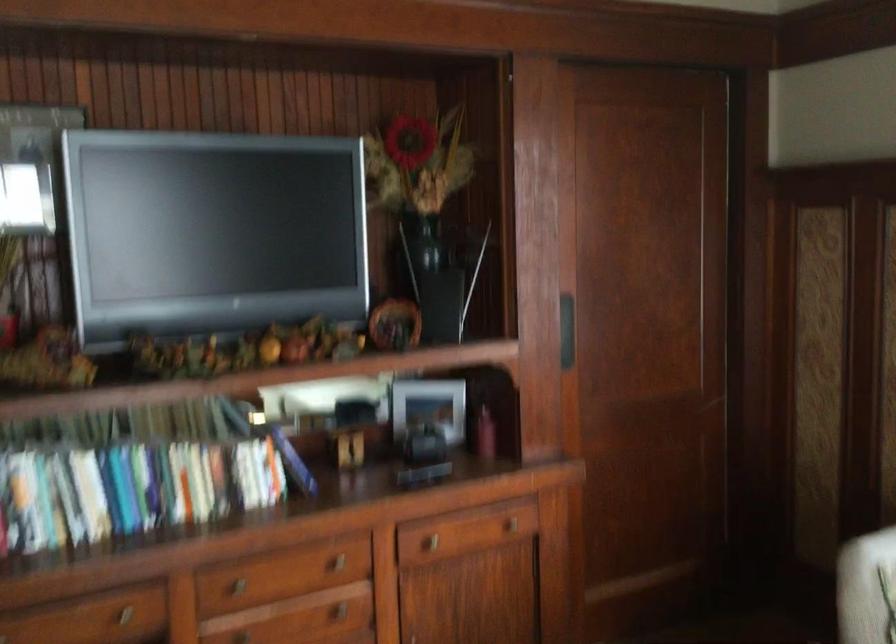
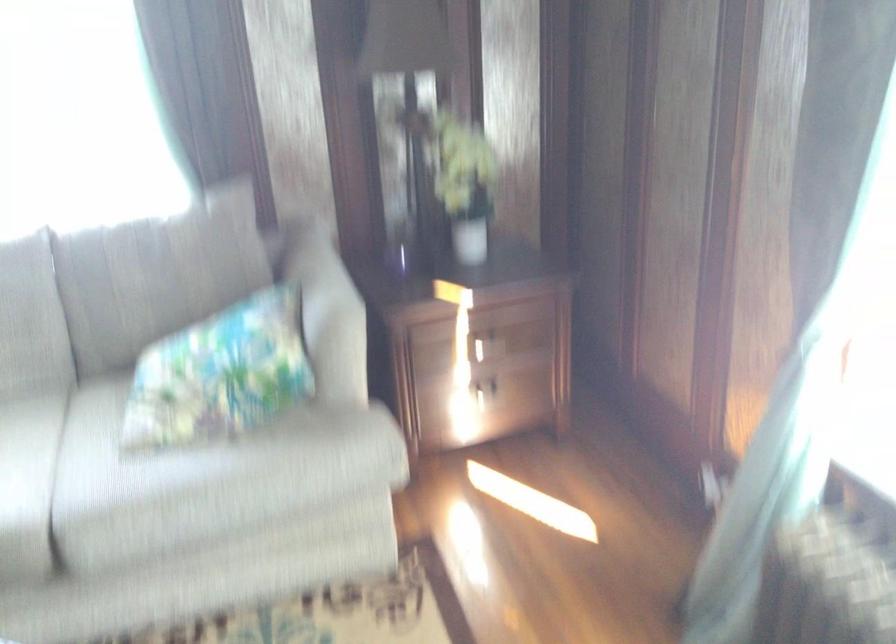
How did the camera likely rotate?

The camera rotated toward right-down.